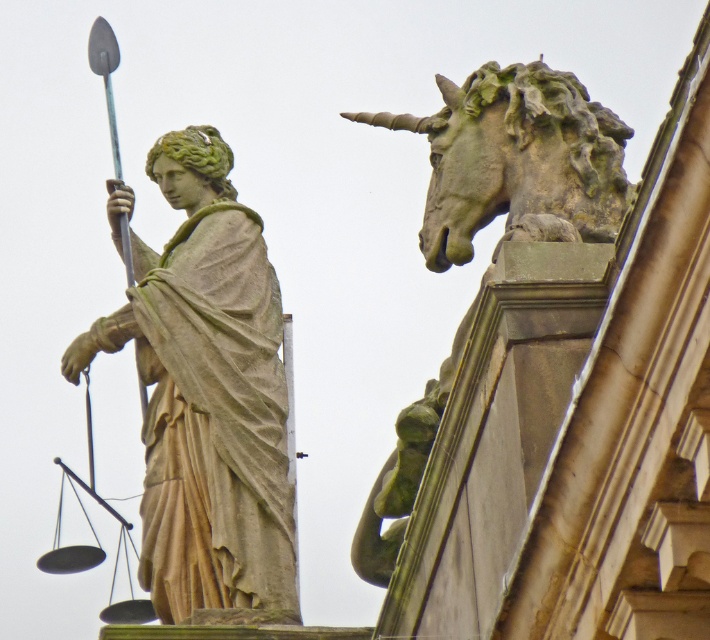
Question: Which point is closer to the camera taking this photo?

Choices:
 (A) (528, 198)
 (B) (209, 369)

Answer: (A)

Question: Is matte stone statue at left below stone unicorn head at upper right?

Choices:
 (A) no
 (B) yes

Answer: (B)

Question: Which point is farther to the camera?

Choices:
 (A) (209, 276)
 (B) (623, 131)

Answer: (A)

Question: Is matte stone statue at left to the left of stone unicorn head at upper right from the viewer's perspective?

Choices:
 (A) no
 (B) yes

Answer: (B)

Question: Does matte stone statue at left have a larger size compared to stone unicorn head at upper right?

Choices:
 (A) yes
 (B) no

Answer: (B)